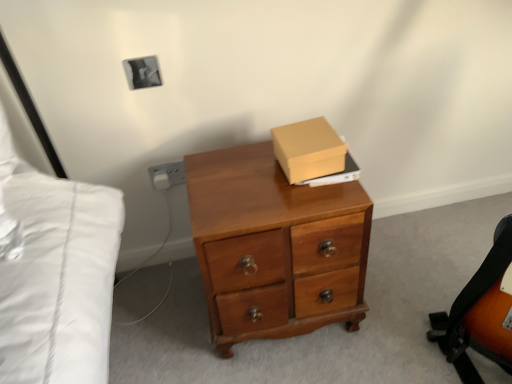
In order to click on vacant space situated on the left part of orange leather messenger bag at lower right in this screenshot , I will do `click(383, 344)`.